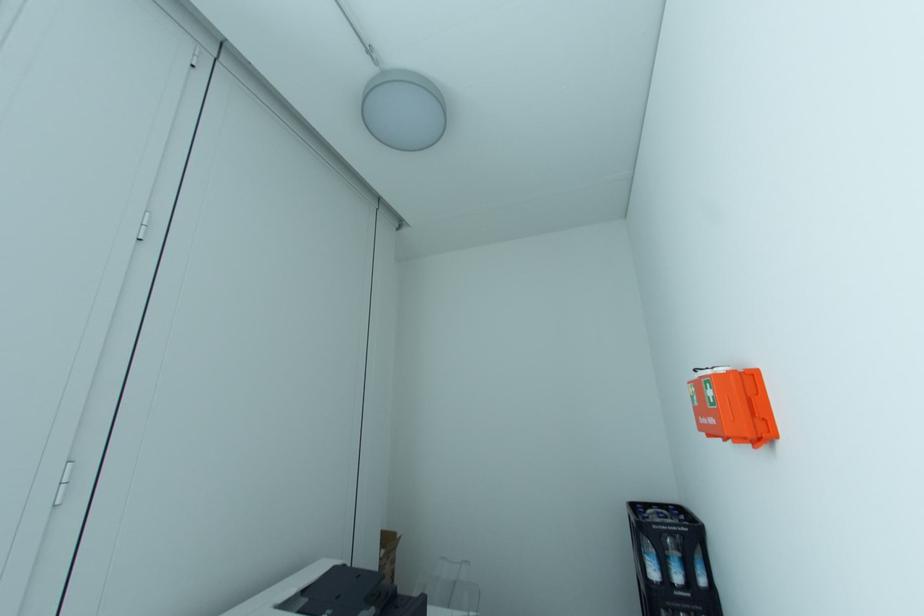
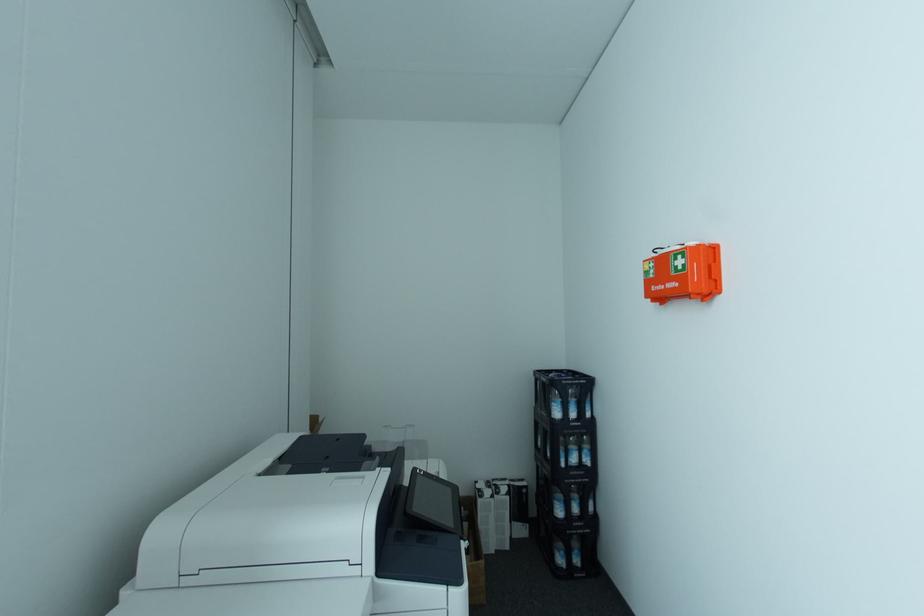
Question: In a continuous first-person perspective shot, in which direction is the camera moving?

Choices:
 (A) Left
 (B) Right
 (C) Forward
 (D) Backward

Answer: (A)